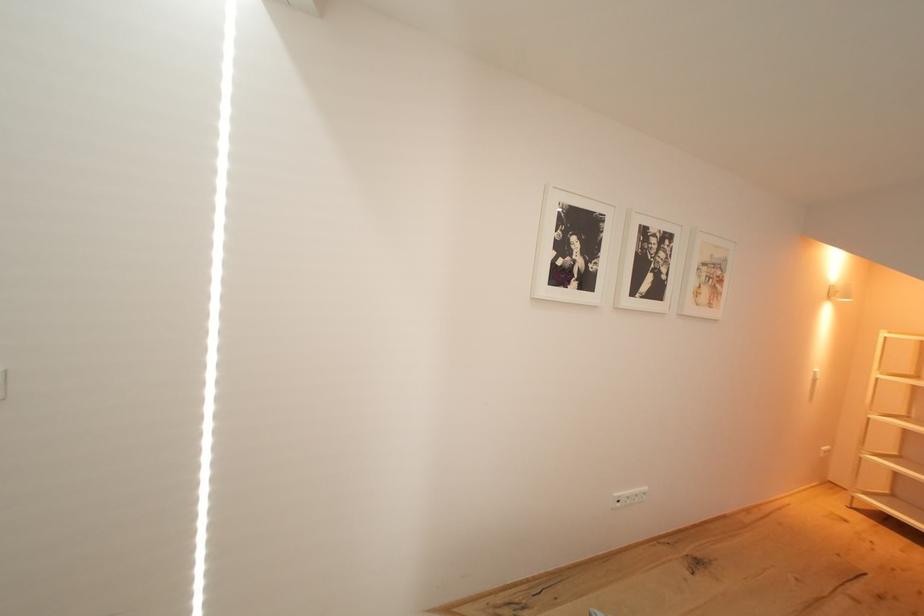
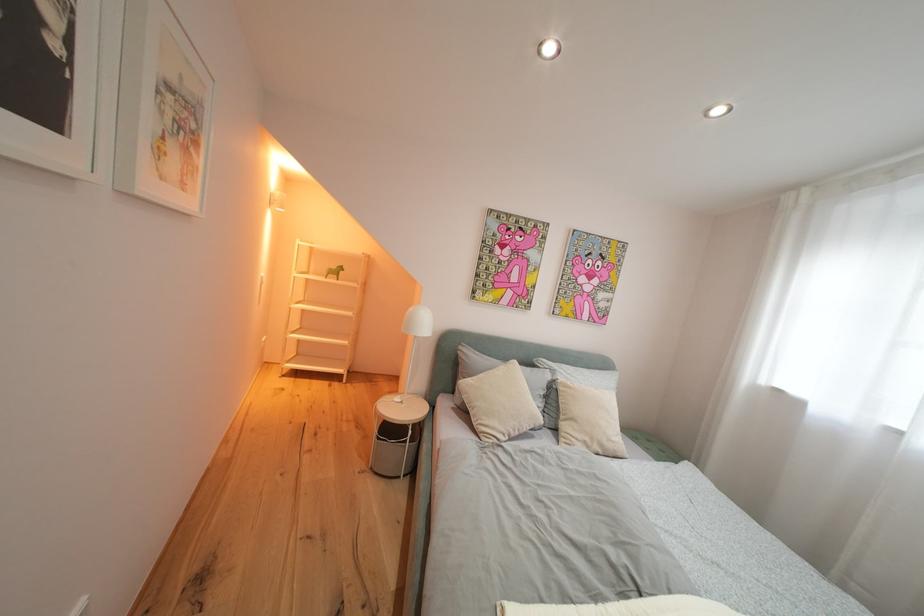
Question: The camera is either moving clockwise (left) or counter-clockwise (right) around the object. The first image is from the beginning of the video and the second image is from the end. Is the camera moving left or right when shooting the video?

Choices:
 (A) Left
 (B) Right

Answer: (A)